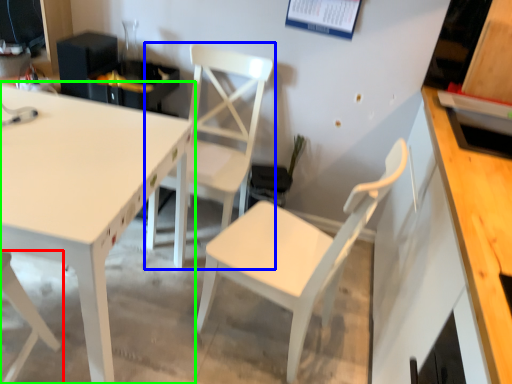
Question: Which object is positioned closest to chair (highlighted by a red box)? Select from chair (highlighted by a blue box) and table (highlighted by a green box).

Choices:
 (A) chair
 (B) table

Answer: (B)